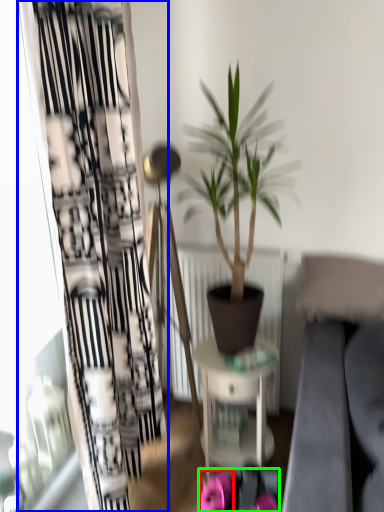
Question: Considering the real-world distances, which object is closest to flower (highlighted by a red box)? curtain (highlighted by a blue box) or flower (highlighted by a green box).

Choices:
 (A) curtain
 (B) flower

Answer: (B)